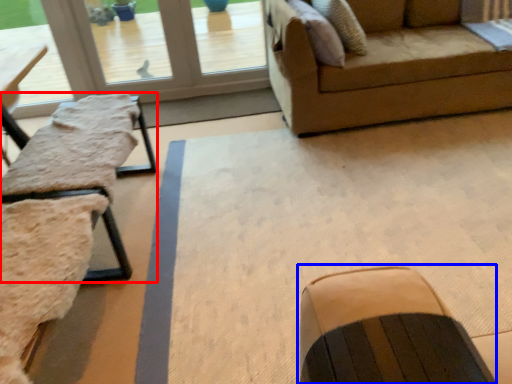
Question: Which object is closer to the camera taking this photo, table (highlighted by a red box) or rocking chair (highlighted by a blue box)?

Choices:
 (A) table
 (B) rocking chair

Answer: (B)